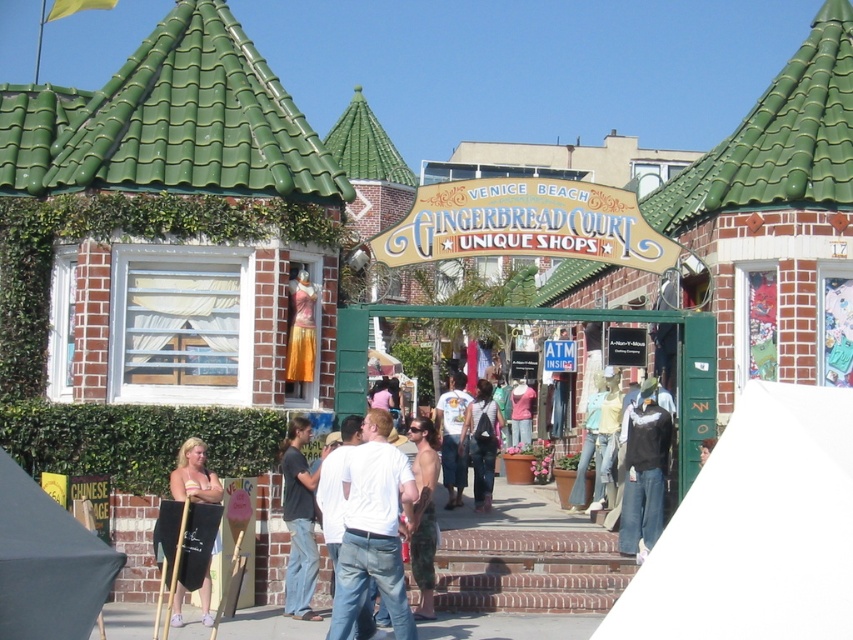
Which is in front, point (628, 477) or point (431, 579)?

Point (431, 579) is in front.

Between point (640, 560) and point (434, 477), which one is positioned in front?

Point (434, 477) is more forward.

Locate an element on the screen. The width and height of the screenshot is (853, 640). dark gray sweater at center is located at coordinates (643, 470).

Can you confirm if dark gray fabric canopy at lower left is positioned below white t-shirt at center?

Correct, dark gray fabric canopy at lower left is located below white t-shirt at center.

Between point (86, 547) and point (438, 404), which one is positioned in front?

Point (86, 547) is in front.

Find the location of a particular element. The width and height of the screenshot is (853, 640). dark gray fabric canopy at lower left is located at coordinates (47, 563).

Is point (773, 422) farther from camera compared to point (361, 499)?

No.

Find the location of `white fabric canopy at center`. white fabric canopy at center is located at coordinates (756, 529).

Who is more distant from viewer, (737, 536) or (393, 572)?

The point (393, 572) is behind.

At what (x,y) coordinates should I click in order to perform the action: click on white fabric canopy at center. Please return your answer as a coordinate pair (x, y). Looking at the image, I should click on (756, 529).